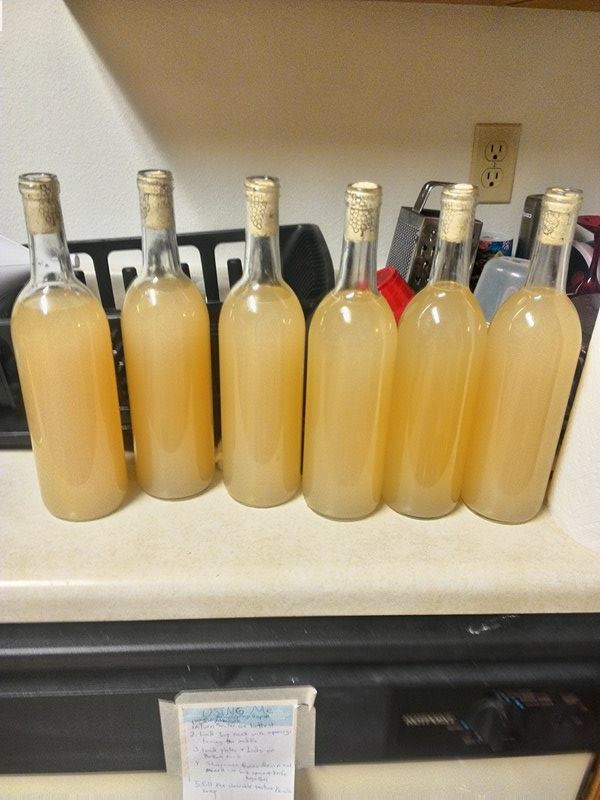
Where is `wine cork`? wine cork is located at coordinates pyautogui.click(x=50, y=202), pyautogui.click(x=167, y=189), pyautogui.click(x=265, y=206), pyautogui.click(x=365, y=221), pyautogui.click(x=456, y=208), pyautogui.click(x=559, y=226).